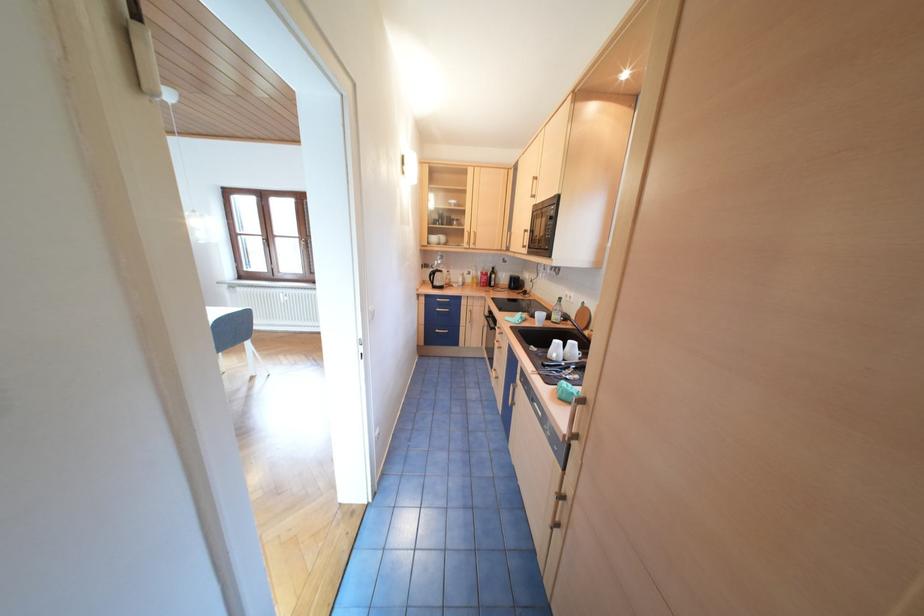
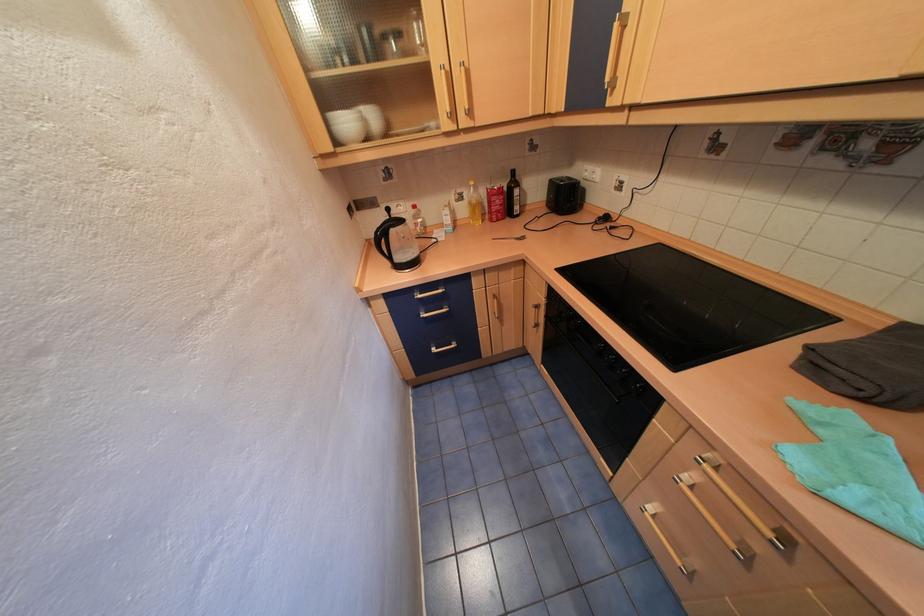
Find the pixel in the second image that matches (x=444, y=238) in the first image.

(357, 123)